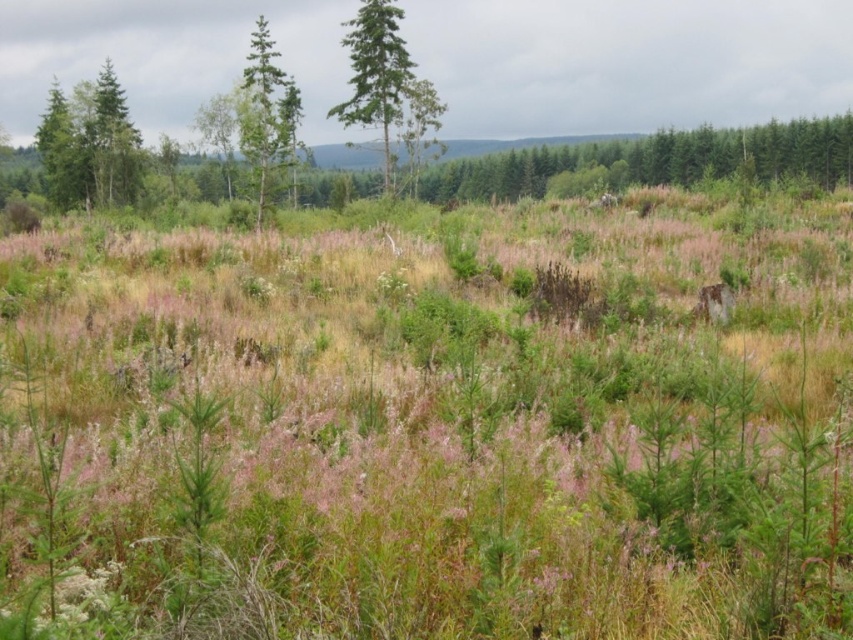
Question: Which object is farther from the camera taking this photo?

Choices:
 (A) green matte tree at left
 (B) green grass at center

Answer: (A)

Question: Where is green grass at center located in relation to green textured tree at center in the image?

Choices:
 (A) right
 (B) left

Answer: (A)

Question: Which point is farther to the camera?

Choices:
 (A) (392, 115)
 (B) (260, 138)

Answer: (A)

Question: Is green matte tree at center above green matte tree at left?

Choices:
 (A) yes
 (B) no

Answer: (A)

Question: Which is nearer to the green textured tree at center?

Choices:
 (A) green matte tree at left
 (B) green matte tree at upper left
 (C) green grass at center
 (D) green matte tree at center

Answer: (D)

Question: Does green grass at center appear under green matte tree at center?

Choices:
 (A) yes
 (B) no

Answer: (A)